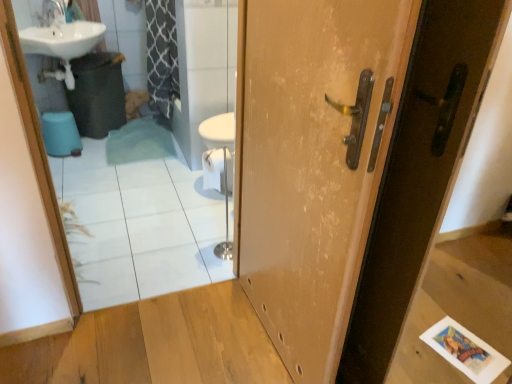
Based on the photo, in order to face blue plastic toilet bowl at lower left, should I rotate leftwards or rightwards?

Turn left by 24.291 degrees to look at blue plastic toilet bowl at lower left.

You are a GUI agent. You are given a task and a screenshot of the screen. Output one action in this format:
    pyautogui.click(x=<x>, y=<y>)
    Task: Click on the wooden door at center
    The height and width of the screenshot is (384, 512).
    Given the screenshot: What is the action you would take?
    pyautogui.click(x=350, y=165)

Is white glossy mirror at upper left further to the viewer compared to blue plastic toilet bowl at lower left?

No, white glossy mirror at upper left is in front of blue plastic toilet bowl at lower left.

Is white glossy mirror at upper left oriented away from blue plastic toilet bowl at lower left?

No, white glossy mirror at upper left's orientation is not away from blue plastic toilet bowl at lower left.

Is white glossy mirror at upper left wider or thinner than blue plastic toilet bowl at lower left?

Clearly, white glossy mirror at upper left has less width compared to blue plastic toilet bowl at lower left.

How far apart are wooden door at center and blue plastic toilet bowl at lower left?

They are 7.54 feet apart.

Is wooden door at center positioned before blue plastic toilet bowl at lower left?

Yes, wooden door at center is closer to the camera.

In the scene shown: Can you confirm if wooden door at center is positioned to the right of blue plastic toilet bowl at lower left?

Indeed, wooden door at center is positioned on the right side of blue plastic toilet bowl at lower left.

From a real-world perspective, is wooden door at center located higher than blue plastic toilet bowl at lower left?

Yes.

Considering the relative sizes of white glossy mirror at upper left and wooden door at center in the image provided, is white glossy mirror at upper left bigger than wooden door at center?

No, white glossy mirror at upper left is not bigger than wooden door at center.

Is point (208, 282) farther from viewer compared to point (255, 66)?

Yes, point (208, 282) is farther from viewer.

From the image's perspective, which is below, white glossy mirror at upper left or wooden door at center?

wooden door at center, from the image's perspective.

Is point (79, 152) behind point (193, 184)?

Yes, point (79, 152) is farther from viewer.

From the image's perspective, is blue plastic toilet bowl at lower left located beneath white glossy mirror at upper left?

No, from the image's perspective, blue plastic toilet bowl at lower left is not beneath white glossy mirror at upper left.

This screenshot has height=384, width=512. I want to click on toilet bowl lying on the left of white glossy mirror at upper left, so click(x=61, y=134).

Is blue plastic toilet bowl at lower left at the right side of white glossy mirror at upper left?

No.

Is wooden door at center not close to white glossy mirror at upper left?

wooden door at center is far away from white glossy mirror at upper left.

Is wooden door at center inside the boundaries of white glossy mirror at upper left, or outside?

wooden door at center cannot be found inside white glossy mirror at upper left.

The width and height of the screenshot is (512, 384). I want to click on door in front of the white glossy mirror at upper left, so click(350, 165).

Which is in front, point (372, 366) or point (193, 193)?

The point (372, 366) is in front.

From the image's perspective, is blue plastic toilet bowl at lower left on top of wooden door at center?

Indeed, from the image's perspective, blue plastic toilet bowl at lower left is shown above wooden door at center.

Is blue plastic toilet bowl at lower left placed right next to wooden door at center?

No, blue plastic toilet bowl at lower left is not touching wooden door at center.

Is blue plastic toilet bowl at lower left taller or shorter than wooden door at center?

Considering their sizes, blue plastic toilet bowl at lower left has less height than wooden door at center.

Consider the image. How different are the orientations of blue plastic toilet bowl at lower left and wooden door at center in degrees?

The facing directions of blue plastic toilet bowl at lower left and wooden door at center are 142 degrees apart.

Locate an element on the screen. toilet bowl behind the white glossy mirror at upper left is located at coordinates (61, 134).

Locate an element on the screen. The image size is (512, 384). toilet bowl that is under the wooden door at center (from a real-world perspective) is located at coordinates pyautogui.click(x=61, y=134).

Estimate the real-world distances between objects in this image. Which object is further from blue plastic toilet bowl at lower left, wooden door at center or white glossy mirror at upper left?

The object further to blue plastic toilet bowl at lower left is wooden door at center.

Estimate the real-world distances between objects in this image. Which object is further from white glossy mirror at upper left, blue plastic toilet bowl at lower left or wooden door at center?

wooden door at center is further to white glossy mirror at upper left.

Based on their spatial positions, is white glossy mirror at upper left or wooden door at center further from blue plastic toilet bowl at lower left?

wooden door at center.

Estimate the real-world distances between objects in this image. Which object is further from white glossy mirror at upper left, wooden door at center or blue plastic toilet bowl at lower left?

wooden door at center is further to white glossy mirror at upper left.

Looking at the image, which one is located further to wooden door at center, white glossy mirror at upper left or blue plastic toilet bowl at lower left?

blue plastic toilet bowl at lower left lies further to wooden door at center than the other object.

Considering their positions, is blue plastic toilet bowl at lower left positioned closer to wooden door at center than white glossy mirror at upper left?

white glossy mirror at upper left lies closer to wooden door at center than the other object.

Image resolution: width=512 pixels, height=384 pixels. What are the coordinates of `mirror between wooden door at center and blue plastic toilet bowl at lower left from front to back` in the screenshot? It's located at (139, 218).